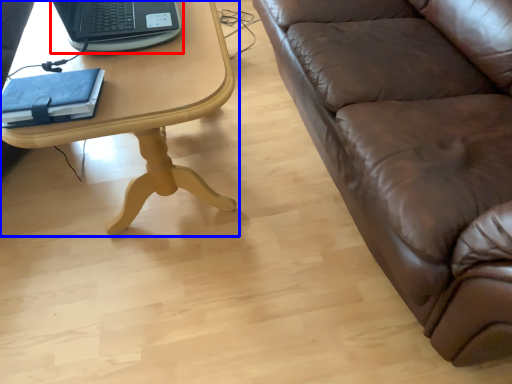
Question: Among these objects, which one is nearest to the camera, laptop (highlighted by a red box) or table (highlighted by a blue box)?

Choices:
 (A) laptop
 (B) table

Answer: (B)